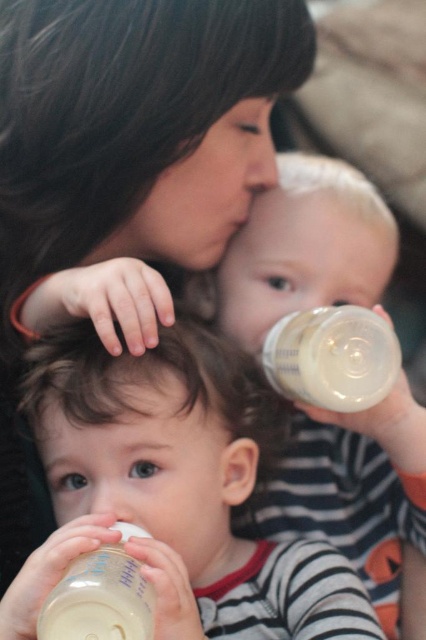
Is translucent plastic bottle at center below transparent plastic bottle at upper center?

Yes, translucent plastic bottle at center is below transparent plastic bottle at upper center.

Does translucent plastic bottle at center have a greater height compared to transparent plastic bottle at upper center?

Yes, translucent plastic bottle at center is taller than transparent plastic bottle at upper center.

Locate an element on the screen. The width and height of the screenshot is (426, 640). translucent plastic bottle at center is located at coordinates (301, 250).

Is white glossy bottle at center to the right of transparent plastic bottle at upper center from the viewer's perspective?

No, white glossy bottle at center is not to the right of transparent plastic bottle at upper center.

Is white glossy bottle at center smaller than transparent plastic bottle at upper center?

No.

Between point (60, 426) and point (322, 390), which one is positioned behind?

The point (60, 426) is more distant.

Find the location of a particular element. The width and height of the screenshot is (426, 640). white glossy bottle at center is located at coordinates (184, 483).

Who is positioned more to the left, transparent plastic bottle at upper center or white opaque bottle at lower left?

white opaque bottle at lower left is more to the left.

Between transparent plastic bottle at upper center and white opaque bottle at lower left, which one is positioned higher?

transparent plastic bottle at upper center

Find the location of `transparent plastic bottle at upper center`. transparent plastic bottle at upper center is located at coordinates (333, 356).

Locate an element on the screen. The width and height of the screenshot is (426, 640). transparent plastic bottle at upper center is located at coordinates (333, 356).